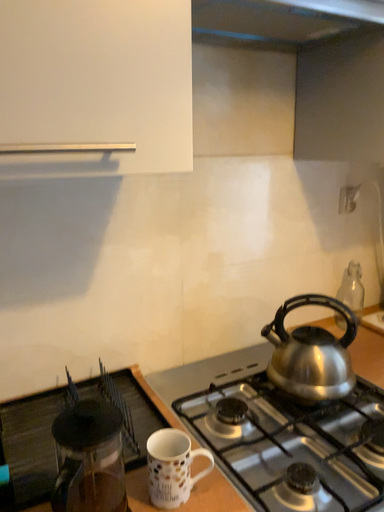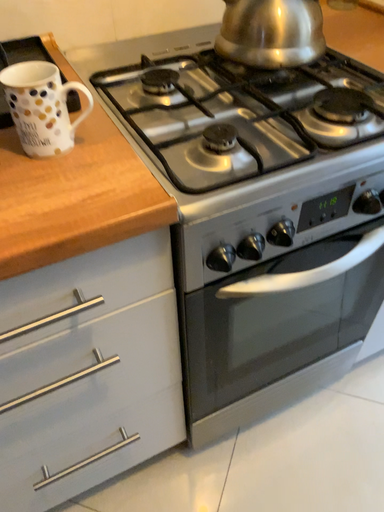
Question: How did the camera likely rotate when shooting the video?

Choices:
 (A) rotated upward
 (B) rotated downward

Answer: (B)